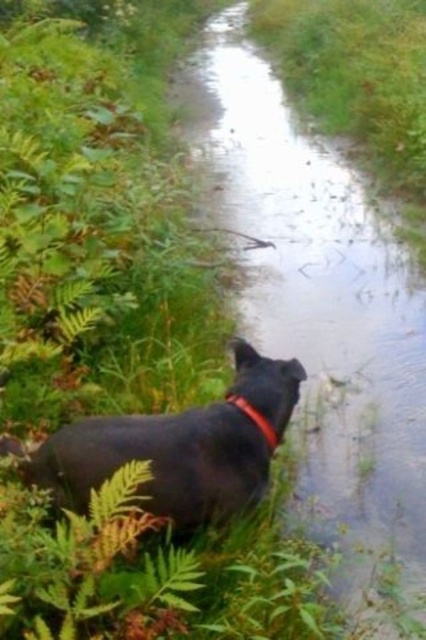
You are a photographer trying to capture the black matte dog at lower left and the clear water at center in the same frame. Based on the scene, which object occupies more horizontal space in the image?

The clear water at center might be wider than black matte dog at lower left, so it likely occupies more horizontal space in the image.

You are a hiker who has spotted a black dog wearing a red collar in the image. The dog is at point (x=181, y=448). Can you confirm if the dog is positioned to the left side of the frame?

Yes, the black matte dog at lower left is positioned at point (x=181, y=448), which is on the left side of the frame.